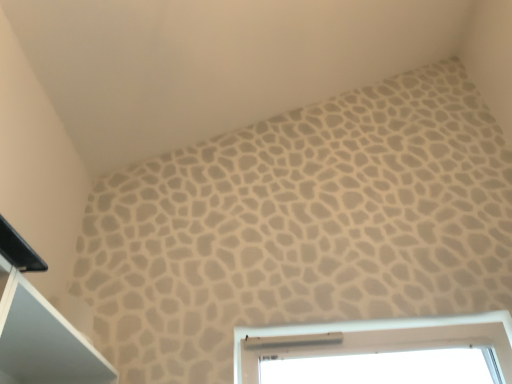
Question: Should I look upward or downward to see black plastic cabinet at upper left?

Choices:
 (A) down
 (B) up

Answer: (A)